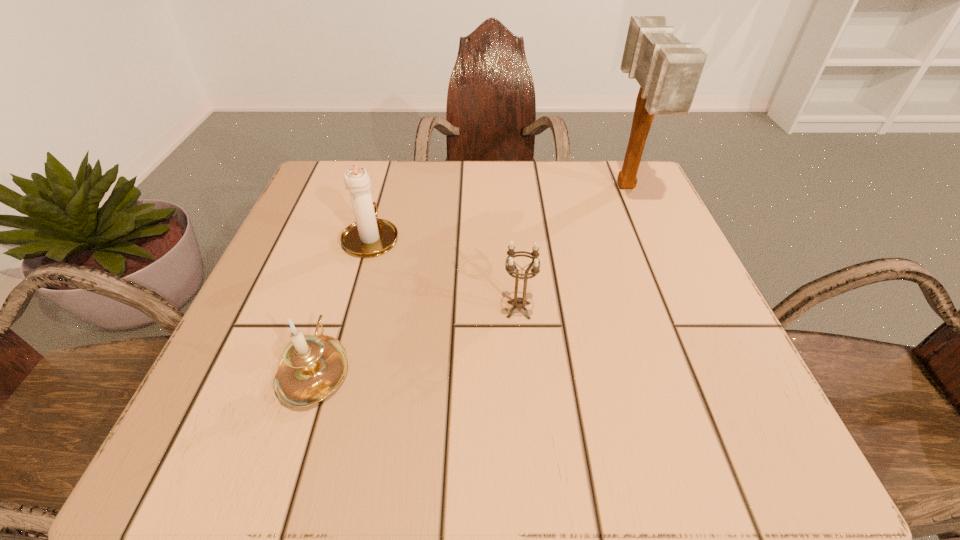
This screenshot has height=540, width=960. I want to click on vacant point located between the nearest candle holder and the tallest candle holder, so click(344, 303).

Where is `vacant point located between the third shortest object and the rightmost candle holder`? The image size is (960, 540). vacant point located between the third shortest object and the rightmost candle holder is located at coordinates (445, 274).

Image resolution: width=960 pixels, height=540 pixels. I want to click on free space between the rightmost candle holder and the nearest object, so click(417, 339).

In order to click on empty space that is in between the nearest object and the farthest candle holder in this screenshot , I will do `click(344, 303)`.

This screenshot has height=540, width=960. What are the coordinates of `vacant area between the rightmost object and the nearest object` in the screenshot? It's located at (470, 278).

This screenshot has height=540, width=960. I want to click on unoccupied area between the tallest object and the third object from left to right, so click(572, 249).

This screenshot has width=960, height=540. Identify the location of free spot between the second nearest object and the rightmost object. (572, 249).

The height and width of the screenshot is (540, 960). I want to click on unoccupied area between the tallest candle holder and the nearest object, so click(x=344, y=303).

Identify which object is the third closest to the second tallest object. Please provide its 2D coordinates. Your answer should be formatted as a tuple, i.e. [(x, y)], where the tuple contains the x and y coordinates of a point satisfying the conditions above.

[(668, 71)]

You are a GUI agent. You are given a task and a screenshot of the screen. Output one action in this format:
    pyautogui.click(x=<x>, y=<y>)
    Task: Click on the object that is the second closest to the third farthest object
    The height and width of the screenshot is (540, 960).
    Given the screenshot: What is the action you would take?
    pyautogui.click(x=312, y=367)